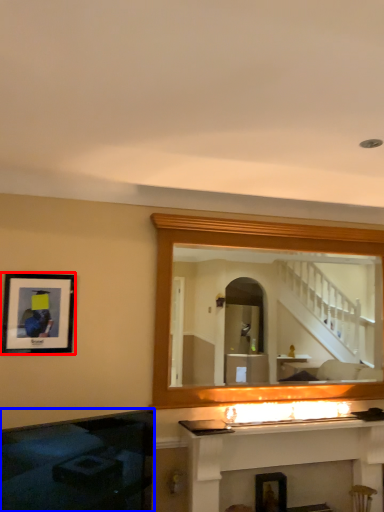
Question: Among these objects, which one is nearest to the camera, picture frame (highlighted by a red box) or fireplace (highlighted by a blue box)?

Choices:
 (A) picture frame
 (B) fireplace

Answer: (B)